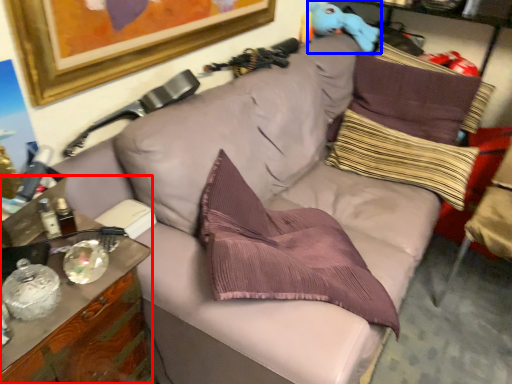
Question: Which object is further to the camera taking this photo, cabinetry (highlighted by a red box) or toy (highlighted by a blue box)?

Choices:
 (A) cabinetry
 (B) toy

Answer: (B)